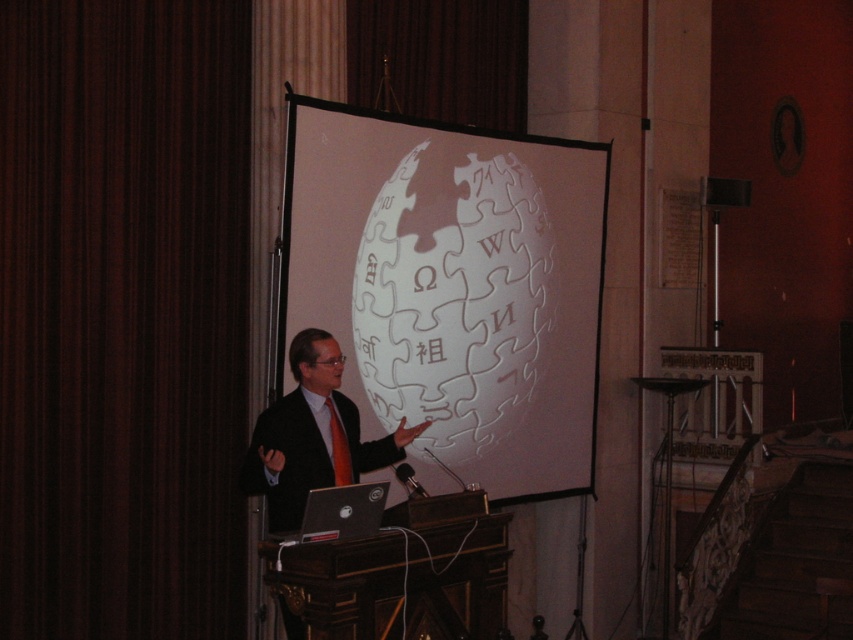
You are an attendee sitting in the front row of the presentation. You notice two items at center stage. Which one is positioned higher? The white matte projection screen at center or the matte black suit at center?

The white matte projection screen at center is located above the matte black suit at center, so it is positioned higher.